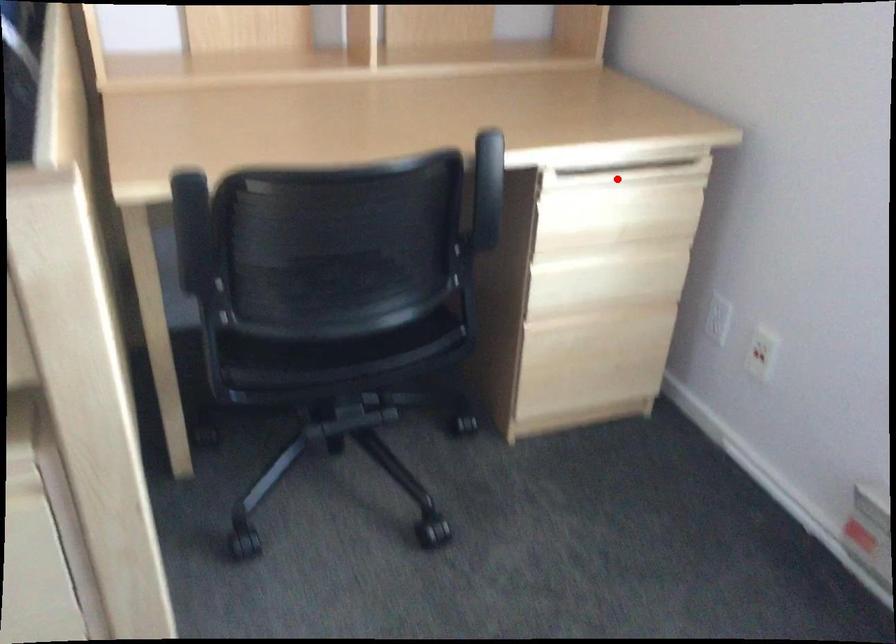
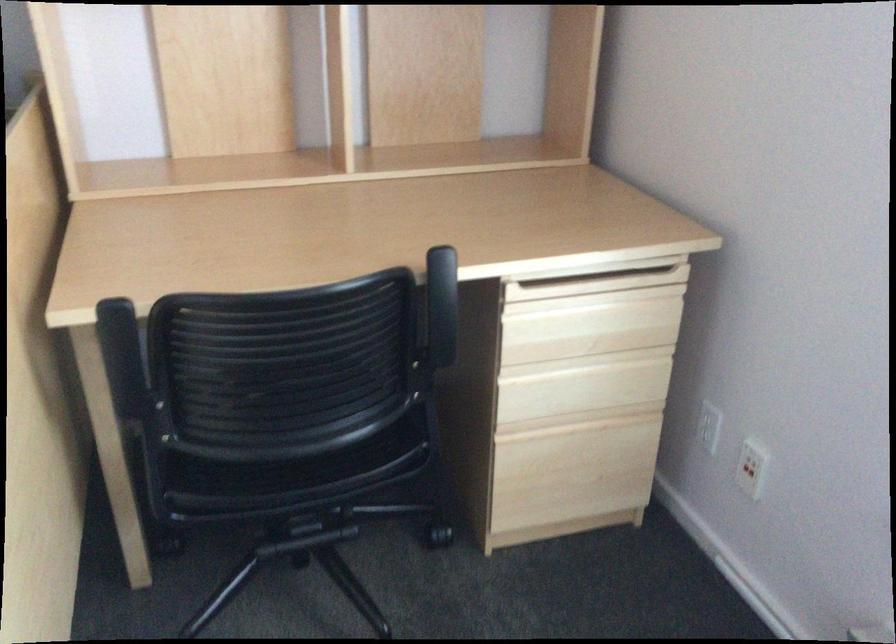
Where in the second image is the point corresponding to the highlighted location from the first image?

(587, 286)